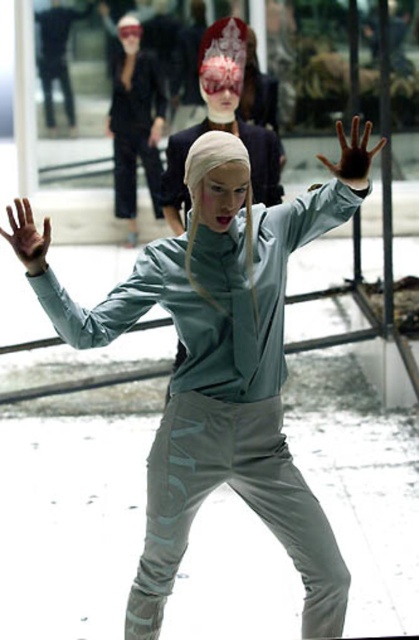
Looking at this image, can you confirm if satin beige wig at center is bigger than matte gray arm at center?

Actually, satin beige wig at center might be smaller than matte gray arm at center.

Can you confirm if satin beige wig at center is smaller than matte gray arm at center?

Indeed, satin beige wig at center has a smaller size compared to matte gray arm at center.

Who is more distant from viewer, [248,248] or [356,138]?

The point [248,248] is behind.

This screenshot has width=419, height=640. In order to click on satin beige wig at center in this screenshot , I will do `click(202, 193)`.

Who is taller, satin beige wig at center or brown matte hand at left?

satin beige wig at center is taller.

The width and height of the screenshot is (419, 640). What do you see at coordinates (202, 193) in the screenshot?
I see `satin beige wig at center` at bounding box center [202, 193].

Where is `satin beige wig at center`? This screenshot has height=640, width=419. satin beige wig at center is located at coordinates (202, 193).

Is matte black arm at upper center positioned behind matte gray hand at center?

Yes, it is.

Does matte black arm at upper center have a greater width compared to matte gray hand at center?

Correct, the width of matte black arm at upper center exceeds that of matte gray hand at center.

At what (x,y) coordinates should I click in order to perform the action: click on matte black arm at upper center. Please return your answer as a coordinate pair (x, y). The width and height of the screenshot is (419, 640). Looking at the image, I should click on (157, 100).